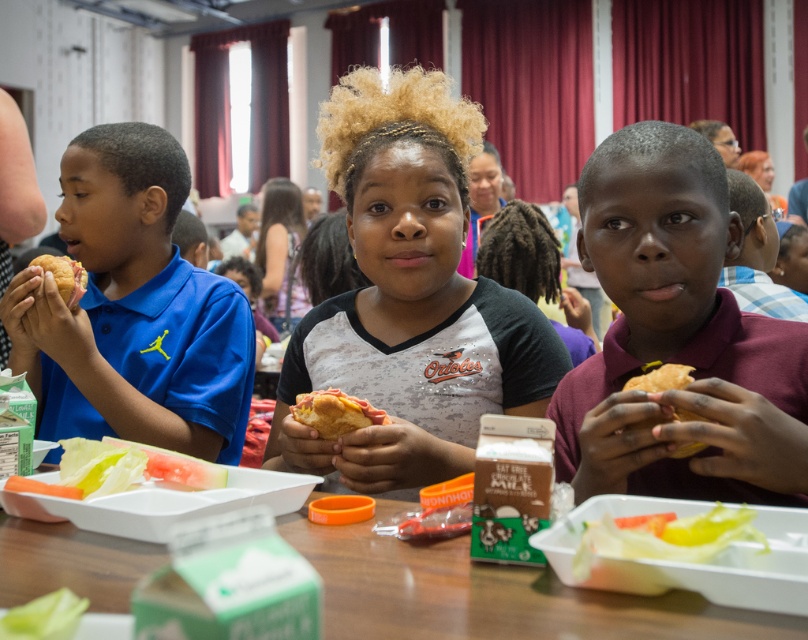
You are a photographer trying to capture a group photo of the children. You notice the white jersey at center and the maroon jersey at right. Which jersey should you adjust to ensure both are visible in the frame without cropping?

You should adjust the white jersey at center because it has a greater height compared to the maroon jersey at right, so lowering it slightly would help both fit within the frame.

Looking at this image, you are a cafeteria worker who needs to arrange the translucent plastic lettuce at lower center and the translucent plastic tray at lower left on a shelf. If the shelf has limited space, which item should you place first to maximize shelf usage?

The translucent plastic lettuce at lower center occupies less space than the translucent plastic tray at lower left, so you should place the translucent plastic tray at lower left first to maximize shelf usage.